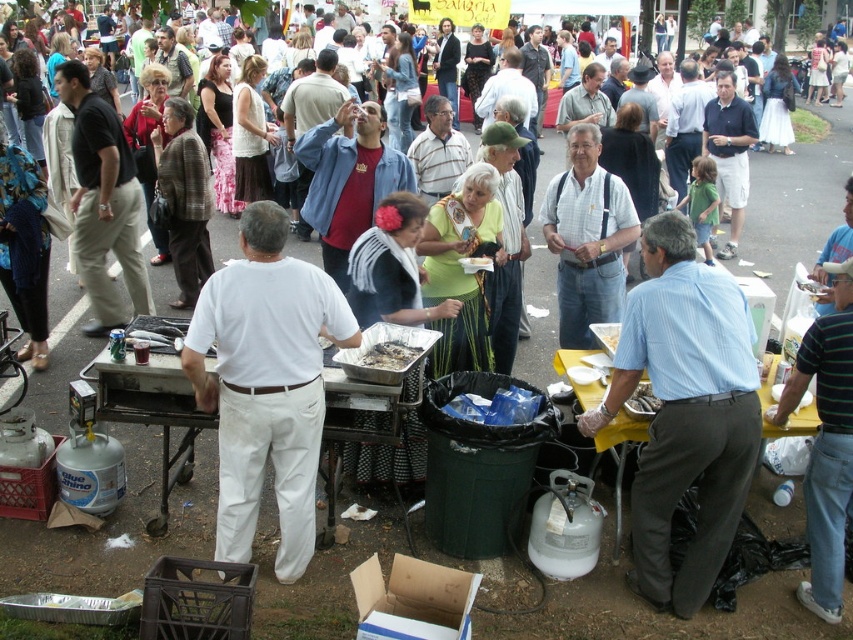
Question: Based on their relative distances, which object is nearer to the light blue striped shirt at center?

Choices:
 (A) charcoal gray metal grill at center
 (B) white cotton shirt at center
 (C) shiny silver tray at center

Answer: (C)

Question: Does white cotton shirt at center appear on the right side of shiny silver spoon at lower center?

Choices:
 (A) no
 (B) yes

Answer: (A)

Question: Where is light blue striped shirt at center located in relation to white cotton shirt at center in the image?

Choices:
 (A) left
 (B) right

Answer: (B)

Question: Which is nearer to the light blue striped shirt at center?

Choices:
 (A) charcoal gray metal grill at center
 (B) shiny silver tray at center

Answer: (B)

Question: Is the position of white cotton shirt at center more distant than that of shiny silver spoon at lower center?

Choices:
 (A) no
 (B) yes

Answer: (A)

Question: Considering the real-world distances, which object is farthest from the shiny silver tray at center?

Choices:
 (A) light blue striped shirt at center
 (B) charcoal gray metal grill at center
 (C) shiny silver spoon at lower center

Answer: (B)